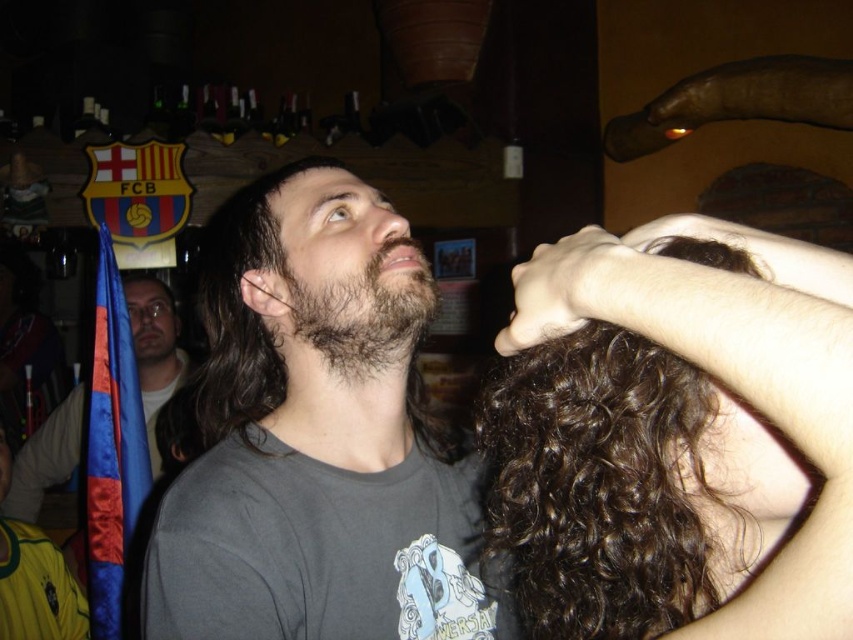
Question: Which point is farther to the camera?

Choices:
 (A) (572, 310)
 (B) (138, 387)

Answer: (B)

Question: Does curly brown hair at center appear on the left side of dark gray t-shirt at center?

Choices:
 (A) no
 (B) yes

Answer: (A)

Question: Does curly brown hair at center have a larger size compared to dark gray t-shirt at center?

Choices:
 (A) yes
 (B) no

Answer: (B)

Question: Estimate the real-world distances between objects in this image. Which object is farther from the dark gray t-shirt at center?

Choices:
 (A) smooth skin hand at upper center
 (B) dark brown fuzzy beard at center
 (C) curly brown hair at center

Answer: (A)

Question: Which point appears closest to the camera in this image?

Choices:
 (A) (590, 310)
 (B) (314, 326)

Answer: (A)

Question: Is gray matte shirt at center above dark gray t-shirt at center?

Choices:
 (A) yes
 (B) no

Answer: (A)